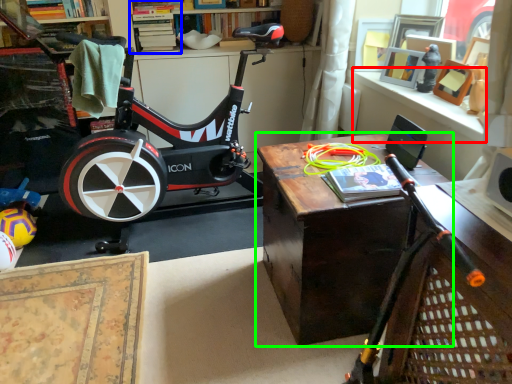
Question: Considering the real-world distances, which object is farthest from window sill (highlighted by a red box)? shelf (highlighted by a blue box) or table (highlighted by a green box)?

Choices:
 (A) shelf
 (B) table

Answer: (A)